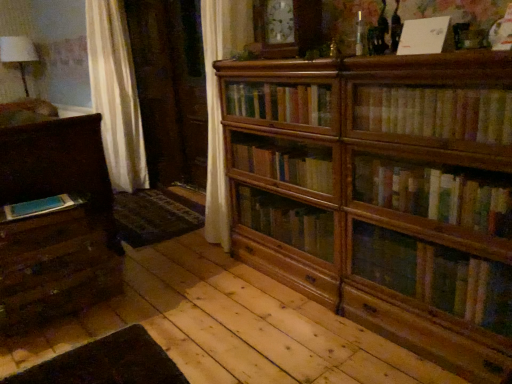
Where is `vacant space that is to the left of wooden bookcase at center`? vacant space that is to the left of wooden bookcase at center is located at coordinates (204, 310).